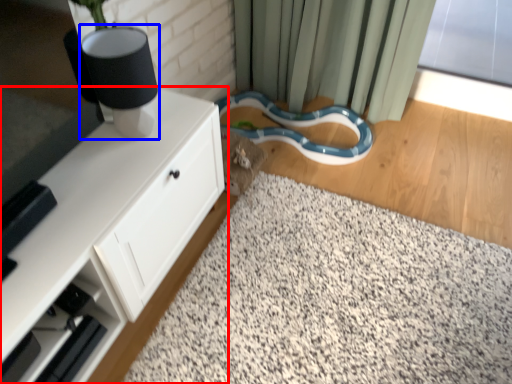
Question: Which of the following is the farthest to the observer, cabinetry (highlighted by a red box) or table lamp (highlighted by a blue box)?

Choices:
 (A) cabinetry
 (B) table lamp

Answer: (B)